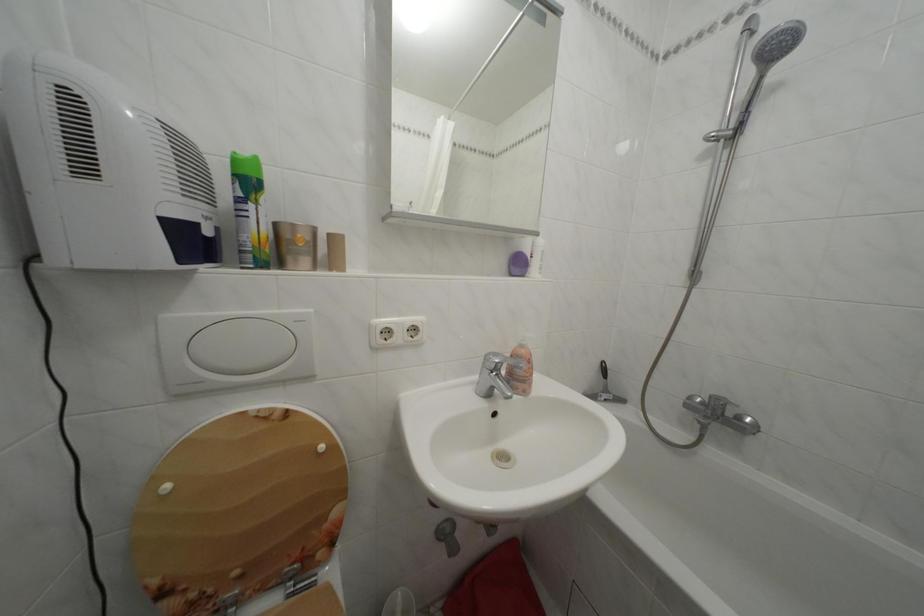
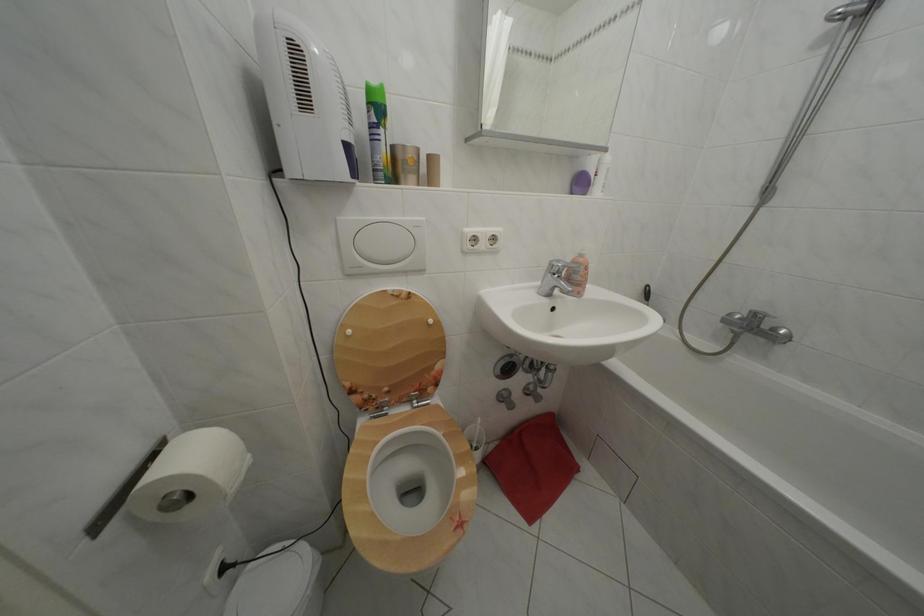
Find the pixel in the second image that matches [505,361] in the first image.

(567, 268)